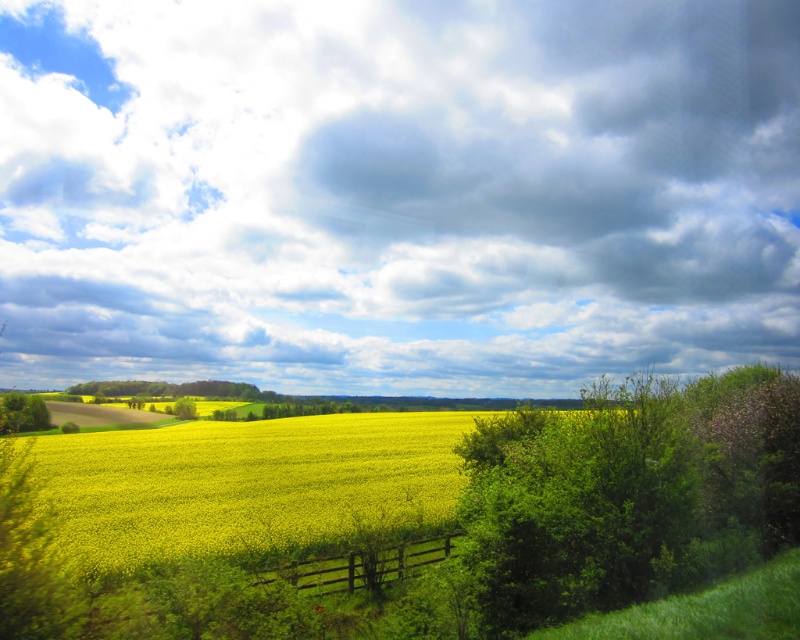
From the picture: You are planning to place a new garden bench in your backyard. You have a brown wooden fence at center and a green leafy tree at lower left. Which object would you choose to place the bench closer to if you want it to be near a smaller structure?

You should place the bench closer to the brown wooden fence at center because it has a smaller size compared to the green leafy tree at lower left.

You are a photographer standing at the edge of the rapeseed field. You want to capture a photo that includes both the cloudy sky at upper center and the wooden fence in the middle ground. Since you can only focus on one subject clearly, which one should you focus on to ensure it appears sharp in the photo?

The cloudy sky at upper center is 161.22 meters from the camera, so you should focus on the wooden fence in the middle ground because it is closer and will appear sharper in the photo.